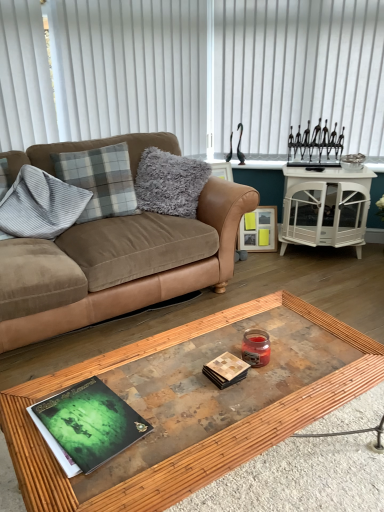
Find the location of a particular element. This screenshot has width=384, height=512. free space in front of green matte book at center, the 2th magazine positioned from the right is located at coordinates (86, 484).